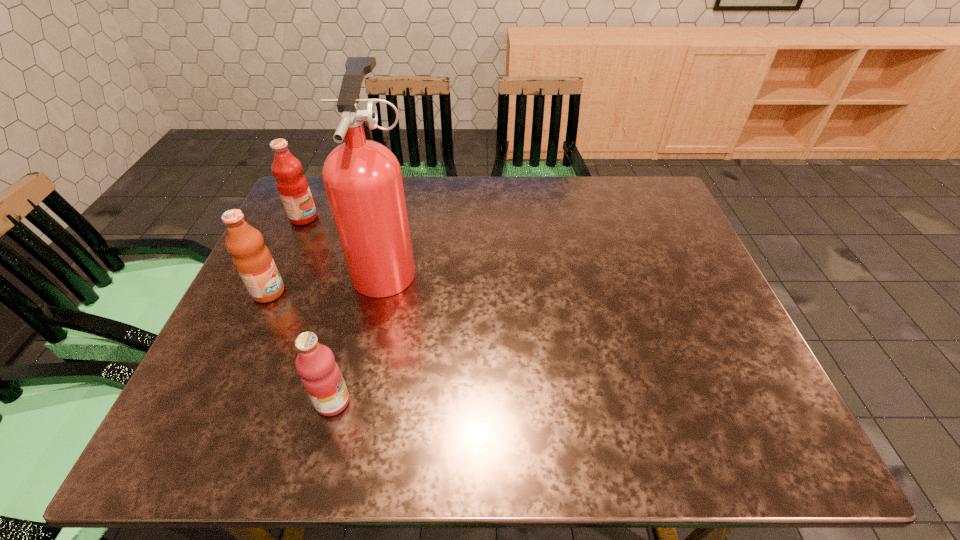
At what (x,y) coordinates should I click in order to perform the action: click on object present at the near edge. Please return your answer as a coordinate pair (x, y). Looking at the image, I should click on (320, 374).

I want to click on object present at the far left corner, so click(292, 185).

What are the coordinates of `free region at the far edge of the desktop` in the screenshot? It's located at (456, 180).

Locate an element on the screen. vacant space at the near edge is located at coordinates (551, 419).

Find the location of a particular element. Image resolution: width=960 pixels, height=540 pixels. blank area at the left edge is located at coordinates (227, 403).

The image size is (960, 540). What are the coordinates of `free spot at the right edge of the desktop` in the screenshot? It's located at (725, 321).

This screenshot has height=540, width=960. I want to click on vacant position at the far left corner of the desktop, so click(313, 177).

At what (x,y) coordinates should I click in order to perform the action: click on vacant space at the near left corner of the desktop. Please return your answer as a coordinate pair (x, y). The image size is (960, 540). Looking at the image, I should click on (221, 448).

The height and width of the screenshot is (540, 960). In order to click on vacant area at the near right corner of the desktop in this screenshot , I will do `click(803, 457)`.

This screenshot has height=540, width=960. I want to click on unoccupied position between the farthest fruit juice and the nearest fruit juice, so click(x=319, y=310).